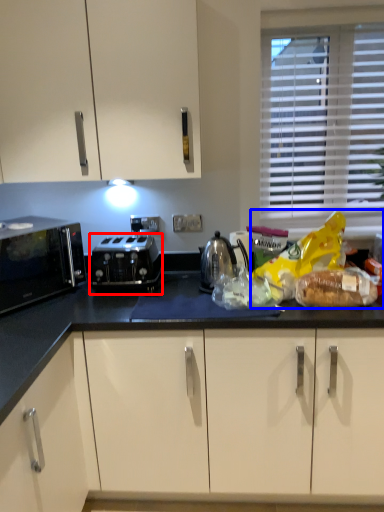
Question: Among these objects, which one is farthest to the camera, toaster (highlighted by a red box) or food (highlighted by a blue box)?

Choices:
 (A) toaster
 (B) food

Answer: (A)